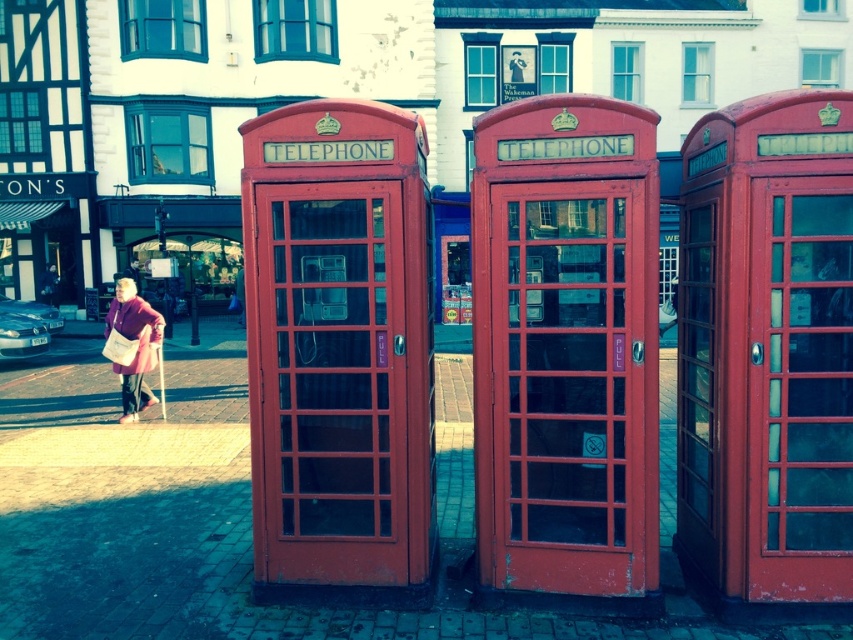
What is the color of the object located at point (132, 342) in the image?

The object at point (132, 342) is a matte purple coat.

You are standing in front of the building and want to take a photo of the telephone booths. You notice two points marked on the ground at coordinates point (146,362) and point (241,292). Which point should you stand closer to in order to have the telephone booths appear larger in your photo?

You should stand closer to point (146,362) because it is closer to the viewer than point (241,292), so the telephone booths will appear larger in the photo.